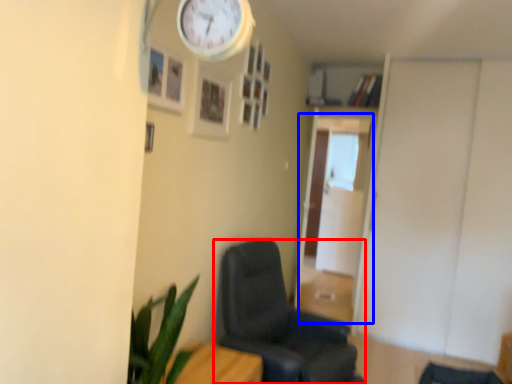
Question: Which object is closer to the camera taking this photo, chair (highlighted by a red box) or glass door (highlighted by a blue box)?

Choices:
 (A) chair
 (B) glass door

Answer: (A)